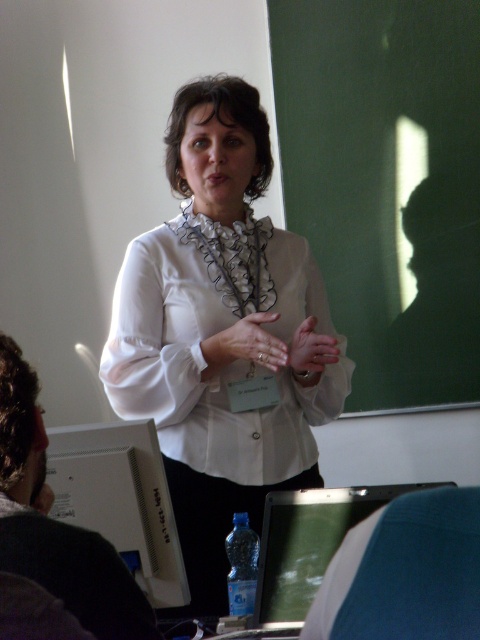
You are a student in the classroom. You need to write a note on the board but realize you don not have chalk. The teacher is at the front. Which object is bigger, the green chalkboard at upper right or the white glossy monitor at lower left?

The green chalkboard at upper right has a larger size compared to the white glossy monitor at lower left, so the green chalkboard at upper right is bigger.